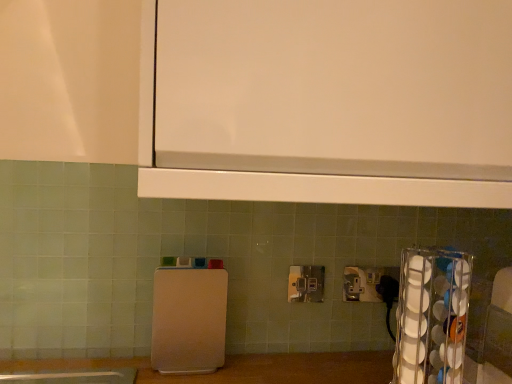
What do you see at coordinates (306, 284) in the screenshot? Image resolution: width=512 pixels, height=384 pixels. I see `metallic silver power plugs and sockets at center` at bounding box center [306, 284].

Measure the distance between clear plastic cup holder at right, arranged as the 1th appliance when viewed from the right, and camera.

clear plastic cup holder at right, arranged as the 1th appliance when viewed from the right, is 26.29 inches from camera.

At what (x,y) coordinates should I click in order to perform the action: click on white plastic cutting board at center, marked as the second appliance in a front-to-back arrangement. Please return your answer as a coordinate pair (x, y). Looking at the image, I should click on (189, 320).

Who is more distant, metallic silver power plugs and sockets at center or clear plastic cup holder at right, arranged as the 1th appliance when viewed from the right?

metallic silver power plugs and sockets at center is further from the camera.

Which is more to the right, metallic silver power plugs and sockets at center or clear plastic cup holder at right, positioned as the second appliance in left-to-right order?

clear plastic cup holder at right, positioned as the second appliance in left-to-right order, is more to the right.

Considering the sizes of objects metallic silver power plugs and sockets at center and clear plastic cup holder at right, acting as the second appliance starting from the back, in the image provided, who is taller, metallic silver power plugs and sockets at center or clear plastic cup holder at right, acting as the second appliance starting from the back,?

Standing taller between the two is clear plastic cup holder at right, acting as the second appliance starting from the back.

Image resolution: width=512 pixels, height=384 pixels. Identify the location of appliance that appears on the right of metallic silver power plugs and sockets at center. (432, 316).

Is clear plastic cup holder at right, which ranks as the first appliance in front-to-back order, with metallic silver power plugs and sockets at center?

No, clear plastic cup holder at right, which ranks as the first appliance in front-to-back order, is not touching metallic silver power plugs and sockets at center.

Is clear plastic cup holder at right, acting as the second appliance starting from the back, positioned with its back to metallic silver power plugs and sockets at center?

clear plastic cup holder at right, acting as the second appliance starting from the back, is not turned away from metallic silver power plugs and sockets at center.

From a real-world perspective, relative to metallic silver power plugs and sockets at center, is clear plastic cup holder at right, positioned as the second appliance in left-to-right order, vertically above or below?

clear plastic cup holder at right, positioned as the second appliance in left-to-right order, is situated lower than metallic silver power plugs and sockets at center in the real world.

Identify the location of the 1st appliance positioned below the metallic silver power plugs and sockets at center (from a real-world perspective). (432, 316).

This screenshot has width=512, height=384. What are the coordinates of `appliance located below the white plastic cutting board at center, the 2th appliance viewed from the right (from the image's perspective)` in the screenshot? It's located at (432, 316).

Does point (195, 279) appear closer or farther from the camera than point (422, 346)?

Point (195, 279) appears to be farther away from the viewer than point (422, 346).

From the image's perspective, between white plastic cutting board at center, the 2th appliance viewed from the right, and clear plastic cup holder at right, arranged as the 1th appliance when viewed from the right, which one is located above?

From the image's view, white plastic cutting board at center, the 2th appliance viewed from the right, is above.

Is white plastic cutting board at center, the 2th appliance viewed from the right, bigger or smaller than clear plastic cup holder at right, which ranks as the first appliance in front-to-back order?

white plastic cutting board at center, the 2th appliance viewed from the right, is smaller than clear plastic cup holder at right, which ranks as the first appliance in front-to-back order.

In the image, there is a white plastic cutting board at center, which is the first appliance from back to front. Identify the location of appliance below it (from the image's perspective). (432, 316).

Can you confirm if clear plastic cup holder at right, arranged as the 1th appliance when viewed from the right, is shorter than white plastic cutting board at center, marked as the second appliance in a front-to-back arrangement?

No.

Considering the positions of point (417, 315) and point (217, 366), is point (417, 315) closer or farther from the camera than point (217, 366)?

Point (417, 315).

Is clear plastic cup holder at right, arranged as the 1th appliance when viewed from the right, oriented away from white plastic cutting board at center, which is the first appliance from back to front?

No.

Between white plastic cutting board at center, the first appliance viewed from the left, and metallic silver power plugs and sockets at center, which one appears on the left side from the viewer's perspective?

From the viewer's perspective, white plastic cutting board at center, the first appliance viewed from the left, appears more on the left side.

Which of these two, white plastic cutting board at center, marked as the second appliance in a front-to-back arrangement, or metallic silver power plugs and sockets at center, is smaller?

Smaller between the two is metallic silver power plugs and sockets at center.

From the picture: Can we say white plastic cutting board at center, the first appliance viewed from the left, lies outside metallic silver power plugs and sockets at center?

Yes, white plastic cutting board at center, the first appliance viewed from the left, is located beyond the bounds of metallic silver power plugs and sockets at center.

Considering the positions of objects white plastic cutting board at center, the first appliance viewed from the left, and metallic silver power plugs and sockets at center in the image provided, who is in front, white plastic cutting board at center, the first appliance viewed from the left, or metallic silver power plugs and sockets at center?

Positioned in front is white plastic cutting board at center, the first appliance viewed from the left.

Which object is closer to the camera taking this photo, metallic silver power plugs and sockets at center or white plastic cutting board at center, which is the first appliance from back to front?

white plastic cutting board at center, which is the first appliance from back to front, is in front.

Is metallic silver power plugs and sockets at center not inside white plastic cutting board at center, which is the first appliance from back to front?

metallic silver power plugs and sockets at center is positioned outside white plastic cutting board at center, which is the first appliance from back to front.

Is metallic silver power plugs and sockets at center wider or thinner than white plastic cutting board at center, marked as the second appliance in a front-to-back arrangement?

Considering their sizes, metallic silver power plugs and sockets at center looks slimmer than white plastic cutting board at center, marked as the second appliance in a front-to-back arrangement.

Considering the relative sizes of metallic silver power plugs and sockets at center and white plastic cutting board at center, which is the first appliance from back to front, in the image provided, is metallic silver power plugs and sockets at center bigger than white plastic cutting board at center, which is the first appliance from back to front,?

No.

Find the location of a particular element. This screenshot has width=512, height=384. the 2nd appliance in front of the metallic silver power plugs and sockets at center, counting from the anchor's position is located at coordinates (432, 316).

Identify the location of power plugs and sockets lying behind the clear plastic cup holder at right, acting as the second appliance starting from the back. (306, 284).

From the image, which object appears to be farther from clear plastic cup holder at right, which ranks as the first appliance in front-to-back order, white plastic cutting board at center, marked as the second appliance in a front-to-back arrangement, or metallic silver power plugs and sockets at center?

white plastic cutting board at center, marked as the second appliance in a front-to-back arrangement, is positioned further to the anchor clear plastic cup holder at right, which ranks as the first appliance in front-to-back order.

Considering their positions, is white plastic cutting board at center, which is the first appliance from back to front, positioned further to metallic silver power plugs and sockets at center than clear plastic cup holder at right, arranged as the 1th appliance when viewed from the right?

The object further to metallic silver power plugs and sockets at center is clear plastic cup holder at right, arranged as the 1th appliance when viewed from the right.

Consider the image. Which object lies nearer to the anchor point white plastic cutting board at center, the first appliance viewed from the left, metallic silver power plugs and sockets at center or clear plastic cup holder at right, positioned as the second appliance in left-to-right order?

metallic silver power plugs and sockets at center is closer to white plastic cutting board at center, the first appliance viewed from the left.

Looking at the image, which one is located closer to white plastic cutting board at center, which is the first appliance from back to front, clear plastic cup holder at right, positioned as the second appliance in left-to-right order, or metallic silver power plugs and sockets at center?

metallic silver power plugs and sockets at center is closer to white plastic cutting board at center, which is the first appliance from back to front.

Which object lies nearer to the anchor point metallic silver power plugs and sockets at center, clear plastic cup holder at right, which ranks as the first appliance in front-to-back order, or white plastic cutting board at center, the first appliance viewed from the left?

white plastic cutting board at center, the first appliance viewed from the left, is positioned closer to the anchor metallic silver power plugs and sockets at center.

Based on their spatial positions, is metallic silver power plugs and sockets at center or white plastic cutting board at center, marked as the second appliance in a front-to-back arrangement, closer to clear plastic cup holder at right, which ranks as the first appliance in front-to-back order?

metallic silver power plugs and sockets at center is positioned closer to the anchor clear plastic cup holder at right, which ranks as the first appliance in front-to-back order.

Locate an element on the screen. power plugs and sockets situated between white plastic cutting board at center, which is the first appliance from back to front, and clear plastic cup holder at right, acting as the second appliance starting from the back, from left to right is located at coordinates (306, 284).